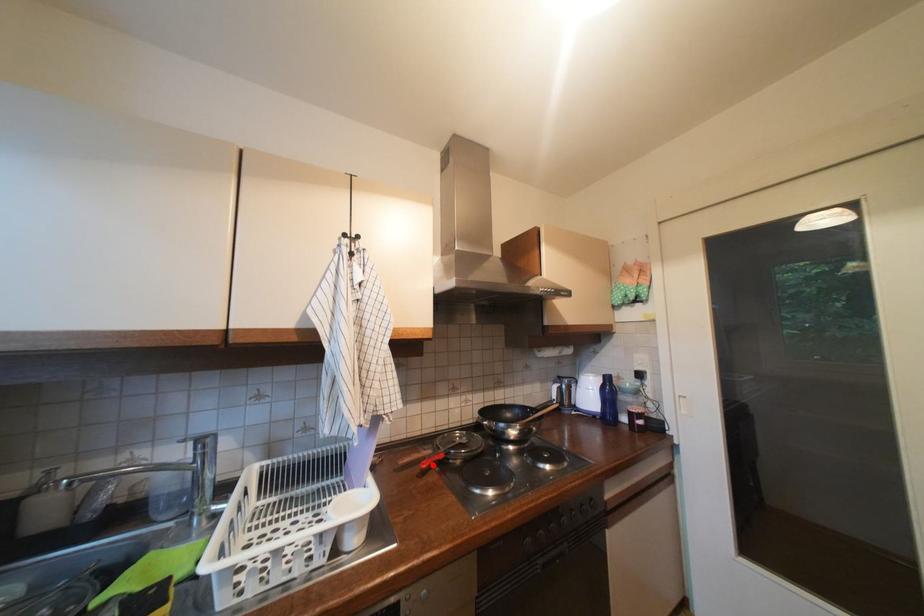
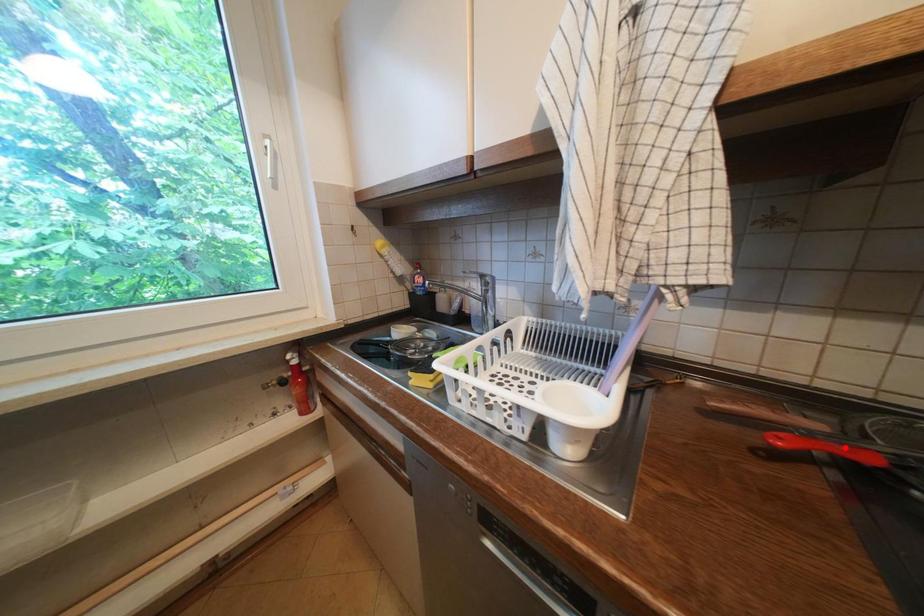
I am providing you with two images of the same scene from different viewpoints. A red point is marked on the first image and another point is marked on the second image. Do the highlighted points in image1 and image2 indicate the same real-world spot?

No